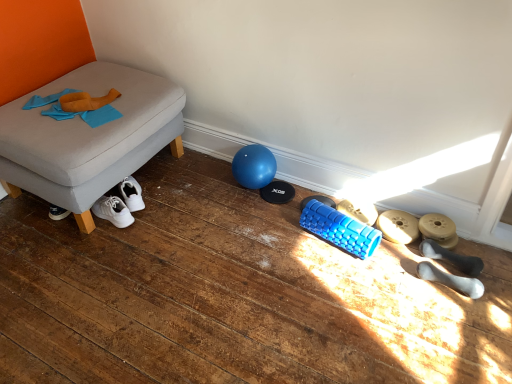
Question: From a real-world perspective, is gray fabric ottoman at left above or below white rubber dumbbells at lower right, the 2th footwear from the front?

Choices:
 (A) above
 (B) below

Answer: (A)

Question: Considering their positions, is gray fabric ottoman at left located in front of or behind white rubber dumbbells at lower right, the 2th footwear from the front?

Choices:
 (A) behind
 (B) front

Answer: (B)

Question: Which object is the closest to the white rubber dumbbells at lower right, the 4th footwear from the back?

Choices:
 (A) gray fabric ottoman at left
 (B) blue rubber roller at lower center, the fifth footwear positioned from the front
 (C) matte gray dumbbell at lower right, the 2th footwear positioned from the back
 (D) white rubber dumbbell at lower right, which ranks as the first footwear in front-to-back order
 (E) matte gold dumbbell at lower right, acting as the third footwear starting from the front

Answer: (E)

Question: Which of these objects is positioned farthest from the matte gray dumbbell at lower right, which appears as the 4th footwear when viewed from the front?

Choices:
 (A) gray fabric ottoman at left
 (B) white rubber dumbbells at lower right, the 4th footwear from the back
 (C) white rubber dumbbell at lower right, placed as the 5th footwear when sorted from back to front
 (D) matte gold dumbbell at lower right, positioned as the 3th footwear in back-to-front order
 (E) blue rubber roller at lower center, which ranks as the first footwear in back-to-front order

Answer: (A)